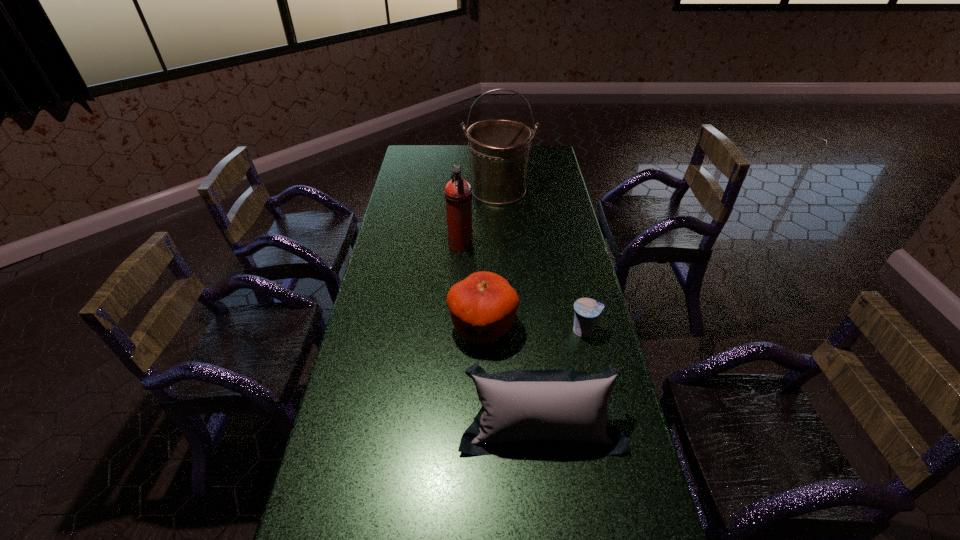
At what (x,y) coordinates should I click in order to perform the action: click on free point located on the back of the pumpkin. Please return your answer as a coordinate pair (x, y). Looking at the image, I should click on (482, 264).

You are a GUI agent. You are given a task and a screenshot of the screen. Output one action in this format:
    pyautogui.click(x=<x>, y=<y>)
    Task: Click on the free spot located on the surface of the cushion
    This screenshot has height=540, width=960.
    Given the screenshot: What is the action you would take?
    pyautogui.click(x=552, y=528)

This screenshot has width=960, height=540. I want to click on free space located on the left of the yogurt, so click(512, 330).

The image size is (960, 540). What are the coordinates of `bucket at the right edge` in the screenshot? It's located at (499, 149).

Identify the location of cushion that is at the right edge. Image resolution: width=960 pixels, height=540 pixels. (565, 410).

Locate an element on the screen. Image resolution: width=960 pixels, height=540 pixels. yogurt located at the right edge is located at coordinates (587, 310).

Identify the location of free region at the left edge. (396, 188).

You are a GUI agent. You are given a task and a screenshot of the screen. Output one action in this format:
    pyautogui.click(x=<x>, y=<y>)
    Task: Click on the free space at the right edge
    The height and width of the screenshot is (540, 960).
    Given the screenshot: What is the action you would take?
    pyautogui.click(x=571, y=314)

Locate an element on the screen. The height and width of the screenshot is (540, 960). vacant area at the far left corner is located at coordinates (408, 146).

Find the location of a particular element. The width and height of the screenshot is (960, 540). vacant area that lies between the second tallest object and the yogurt is located at coordinates (522, 288).